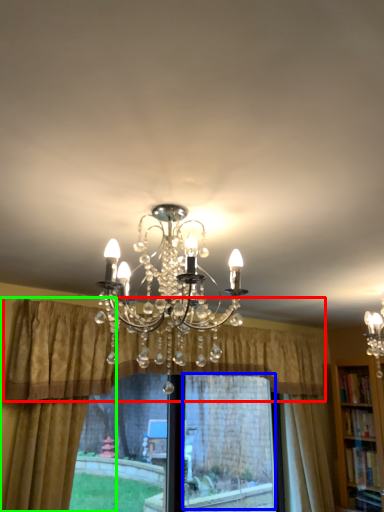
Question: Considering the real-world distances, which object is farthest from curtain (highlighted by a red box)? window screen (highlighted by a blue box) or curtain (highlighted by a green box)?

Choices:
 (A) window screen
 (B) curtain

Answer: (B)